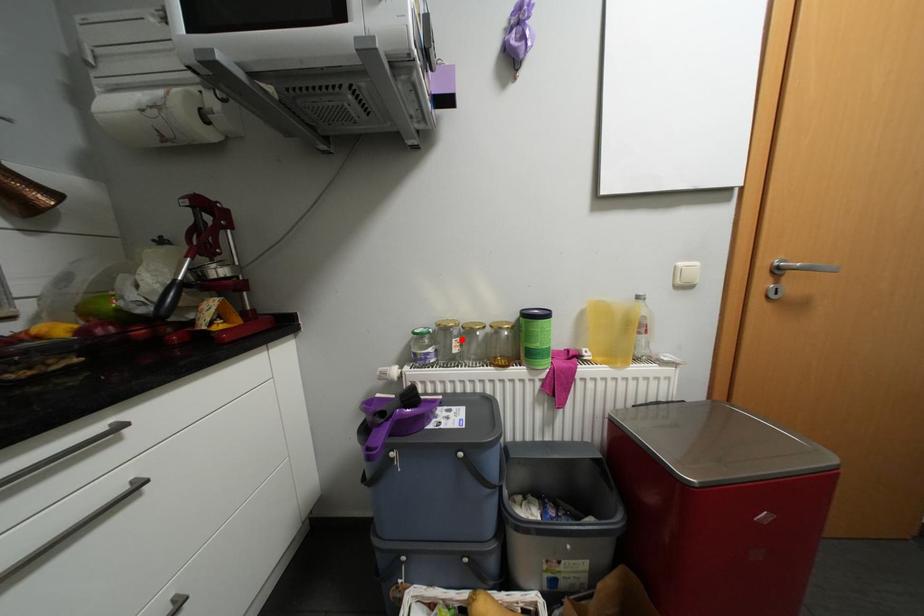
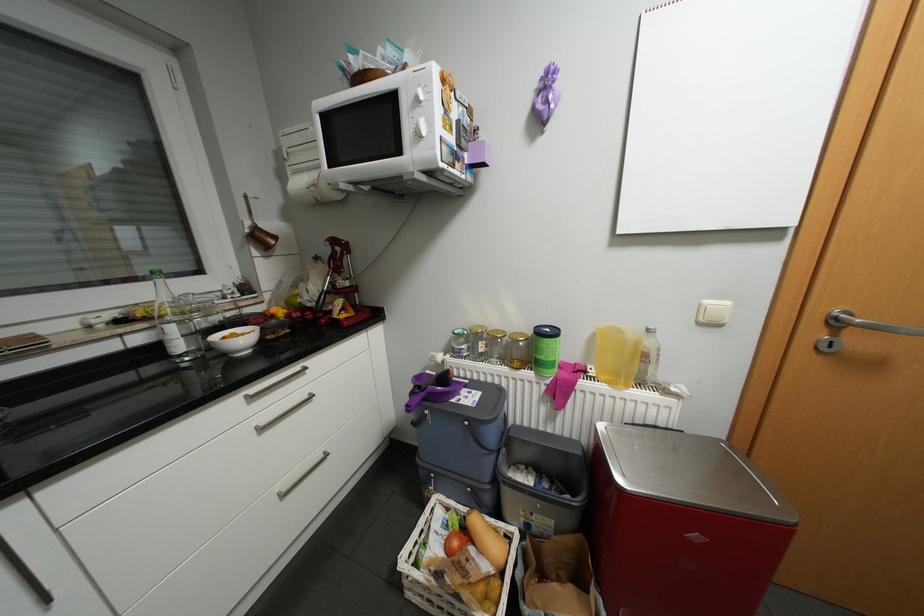
Where in the second image is the point corresponding to the highlighted location from the first image?

(488, 342)